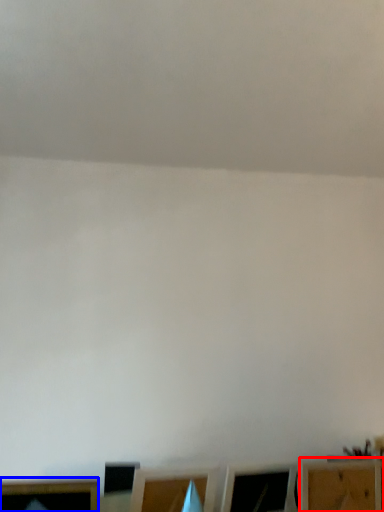
Question: Which point is closer to the camera, furniture (highlighted by a red box) or furniture (highlighted by a blue box)?

Choices:
 (A) furniture
 (B) furniture

Answer: (B)